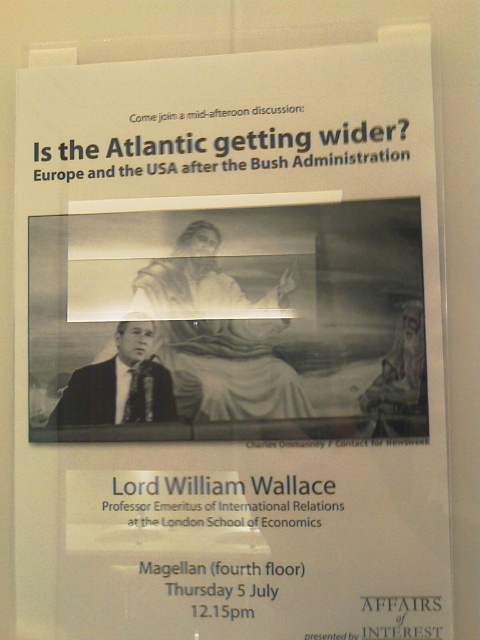
You are designing a poster and need to ensure that the white paper at center and the matte black suit at center are visually balanced. Given their sizes, which object should be placed farther from the center to maintain balance?

The white paper at center should be placed farther from the center because it has a greater height than the matte black suit at center, so to balance the visual weight, the larger object needs to be positioned farther away.

You are organizing a poster for an event and need to ensure that the white paper at center and the matte black suit at center are clearly visible. Based on their positions, which object is more likely to catch the viewer s attention first?

The white paper at center is in front of the matte black suit at center, so it will likely catch the viewer s attention first due to its prominent placement in front.